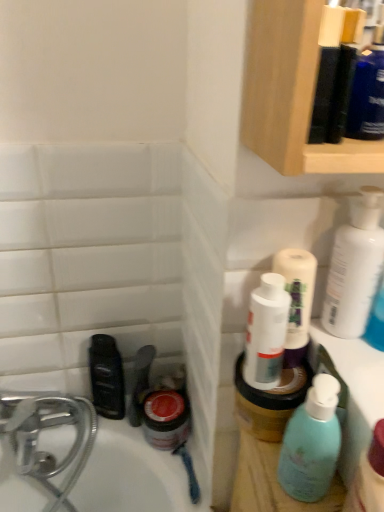
Question: Relative to white glossy lotion at upper right, is teal matte bottle at right in front or behind?

Choices:
 (A) front
 (B) behind

Answer: (A)

Question: Which is correct: teal matte bottle at right is inside white glossy lotion at upper right, or outside of it?

Choices:
 (A) inside
 (B) outside

Answer: (B)

Question: Based on their relative distances, which object is farther from the white glossy lotion at upper right?

Choices:
 (A) black plastic mouthwash at lower left
 (B) teal matte bottle at right

Answer: (A)

Question: Which of these objects is positioned farthest from the black plastic mouthwash at lower left?

Choices:
 (A) teal matte bottle at right
 (B) white glossy lotion at upper right

Answer: (B)